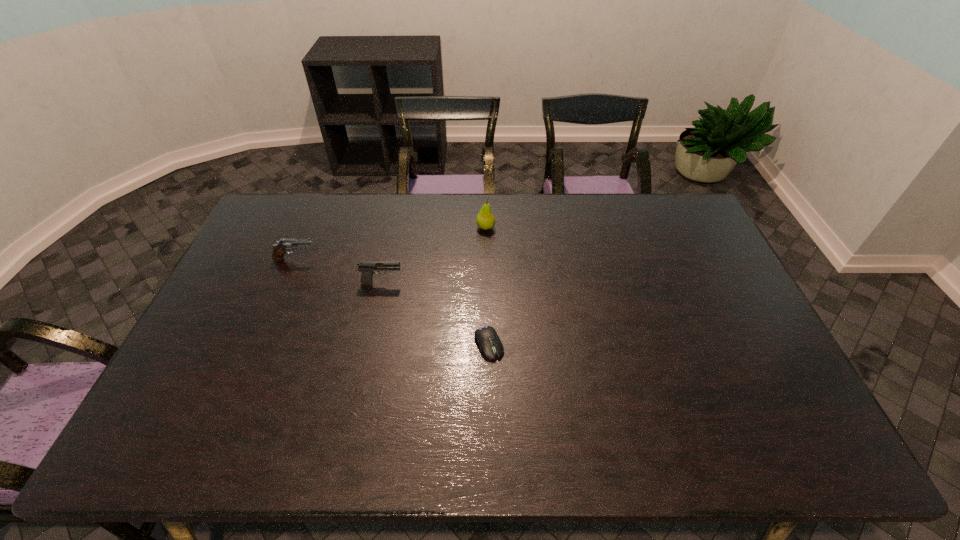
Locate an element on the screen. The height and width of the screenshot is (540, 960). empty space that is in between the farthest object and the third object from right to left is located at coordinates (434, 255).

The image size is (960, 540). I want to click on free space between the leftmost object and the pear, so click(x=391, y=244).

I want to click on free space between the tallest object and the nearest object, so click(x=488, y=286).

This screenshot has height=540, width=960. Find the location of `vacant space that is in between the farthest object and the nearest object`. vacant space that is in between the farthest object and the nearest object is located at coordinates (488, 286).

At what (x,y) coordinates should I click in order to perform the action: click on free point between the nearest object and the nearer pistol. Please return your answer as a coordinate pair (x, y). The height and width of the screenshot is (540, 960). Looking at the image, I should click on (436, 313).

At what (x,y) coordinates should I click in order to perform the action: click on empty space between the second object from left to right and the second farthest object. Please return your answer as a coordinate pair (x, y). The image size is (960, 540). Looking at the image, I should click on (339, 271).

Identify the location of free space between the farthest object and the nearer pistol. (434, 255).

Locate an element on the screen. unoccupied area between the computer equipment and the nearer pistol is located at coordinates (436, 313).

Identify which object is located as the third nearest to the leftmost object. Please provide its 2D coordinates. Your answer should be formatted as a tuple, i.e. [(x, y)], where the tuple contains the x and y coordinates of a point satisfying the conditions above.

[(490, 345)]

The height and width of the screenshot is (540, 960). What are the coordinates of `object that ranks as the second closest to the left pistol` in the screenshot? It's located at (485, 219).